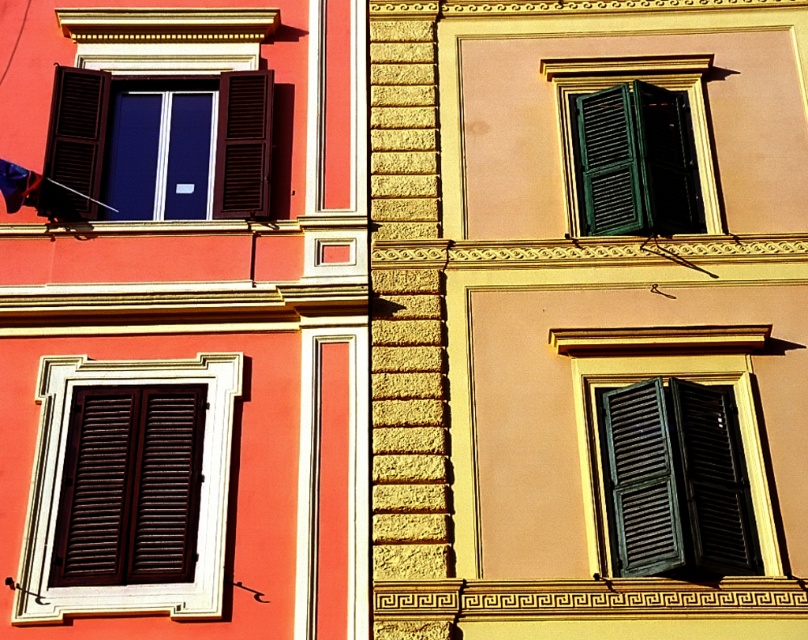
You are standing in front of the building and notice two shutters on the left side of the facade. Which one is positioned more to the right between the matte brown shutters at lower left and the matte black shutters at upper left?

The matte brown shutters at lower left are positioned more to the right compared to the matte black shutters at upper left.

You are an architect inspecting the building facade. You notice the matte brown shutters at lower left and the matte black shutters at upper left. Which of these two shutters is closer to you from your current viewpoint?

The matte brown shutters at lower left are closer to you because they are positioned in front of the matte black shutters at upper left.

You are an architect designing a new building facade. You need to ensure that the width of the matte brown shutters at lower left and the green matte shutters at lower right are proportionate to their respective walls. Based on the image provided, which shutters have a smaller width?

The matte brown shutters at lower left have a lesser width compared to the green matte shutters at lower right, so the matte brown shutters at lower left are smaller in width.